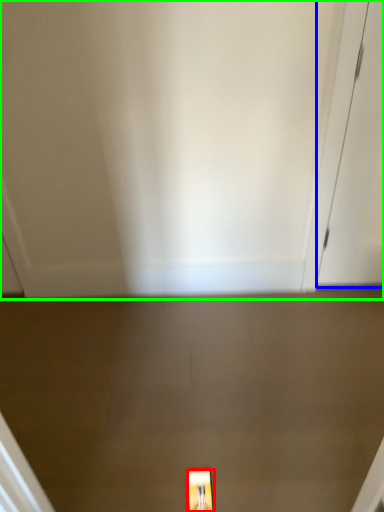
Question: Which object is positioned farthest from light fixture (highlighted by a red box)? Select from door (highlighted by a blue box) and door (highlighted by a green box).

Choices:
 (A) door
 (B) door

Answer: (A)